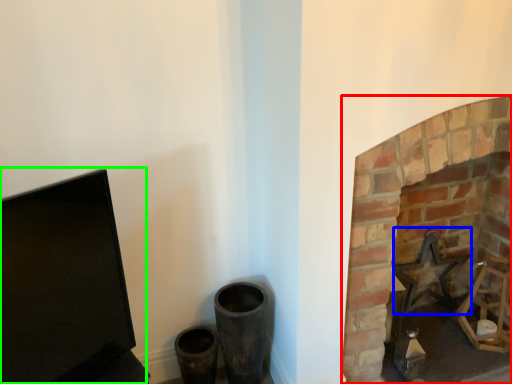
Question: Considering the real-world distances, which object is farthest from fireplace (highlighted by a red box)? swivel chair (highlighted by a blue box) or computer monitor (highlighted by a green box)?

Choices:
 (A) swivel chair
 (B) computer monitor

Answer: (B)